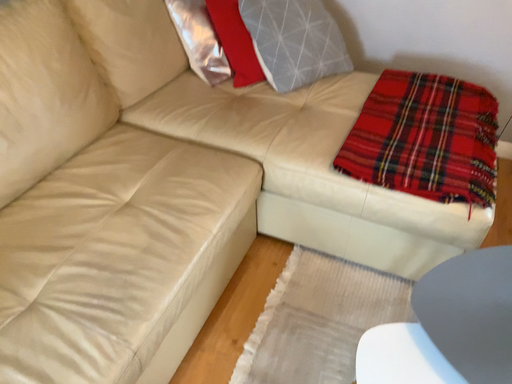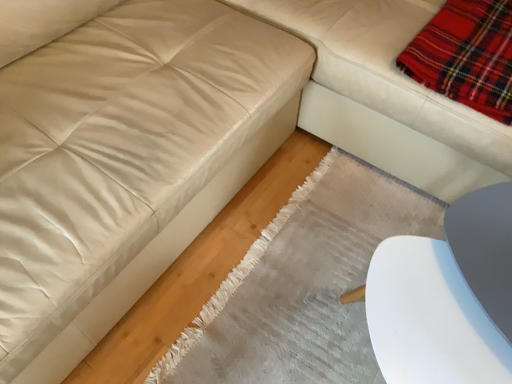
Question: Which way did the camera rotate in the video?

Choices:
 (A) rotated left
 (B) rotated right

Answer: (A)